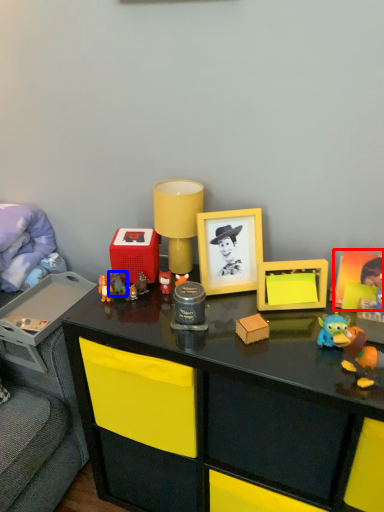
Question: Among these objects, which one is nearest to the camera, picture frame (highlighted by a red box) or toy (highlighted by a blue box)?

Choices:
 (A) picture frame
 (B) toy

Answer: (A)